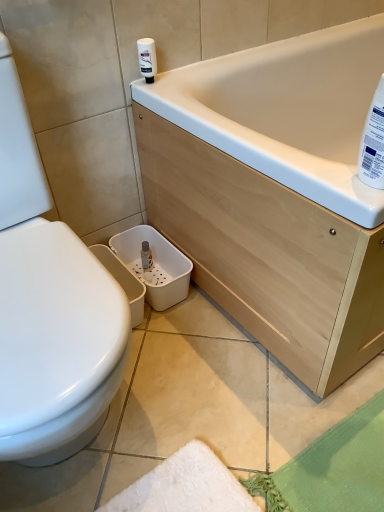
Question: In which direction should I rotate to look at white plastic bottle at upper center, the second cleaning product from the right?

Choices:
 (A) right
 (B) left

Answer: (B)

Question: Is there a large distance between white plastic bottle at upper center, which is the 1th cleaning product in left-to-right order, and white plastic bottle at upper right, which ranks as the 1th cleaning product in front-to-back order?

Choices:
 (A) yes
 (B) no

Answer: (B)

Question: Does white plastic bottle at upper center, the first cleaning product positioned from the top, touch white plastic bottle at upper right, the first cleaning product viewed from the right?

Choices:
 (A) yes
 (B) no

Answer: (B)

Question: Is white plastic bottle at upper center, the first cleaning product positioned from the top, in front of white plastic bottle at upper right, which ranks as the 1th cleaning product in front-to-back order?

Choices:
 (A) no
 (B) yes

Answer: (A)

Question: Can you confirm if white plastic bottle at upper center, the 2th cleaning product ordered from the bottom, is bigger than white plastic bottle at upper right, which ranks as the 1th cleaning product in front-to-back order?

Choices:
 (A) yes
 (B) no

Answer: (B)

Question: From a real-world perspective, is white plastic bottle at upper center, the second cleaning product from the right, beneath white plastic bottle at upper right, which ranks as the 1th cleaning product in front-to-back order?

Choices:
 (A) yes
 (B) no

Answer: (A)

Question: Does white plastic bottle at upper center, which is the 1th cleaning product in left-to-right order, appear on the left side of white plastic bottle at upper right, which ranks as the 1th cleaning product in front-to-back order?

Choices:
 (A) no
 (B) yes

Answer: (B)

Question: From a real-world perspective, is white plastic bottle at upper right, the 1th cleaning product ordered from the bottom, beneath white plastic bottle at upper center, which is the 1th cleaning product in back-to-front order?

Choices:
 (A) yes
 (B) no

Answer: (B)

Question: Does white plastic bottle at upper right, the second cleaning product from the left, have a greater width compared to white plastic bottle at upper center, which is counted as the second cleaning product, starting from the front?

Choices:
 (A) no
 (B) yes

Answer: (B)

Question: Is white plastic bottle at upper right, the second cleaning product from the top, surrounding white plastic bottle at upper center, the second cleaning product from the right?

Choices:
 (A) no
 (B) yes

Answer: (A)

Question: Is white plastic bottle at upper right, the first cleaning product viewed from the right, not within white plastic bottle at upper center, which is counted as the second cleaning product, starting from the front?

Choices:
 (A) yes
 (B) no

Answer: (A)

Question: Can you confirm if white plastic bottle at upper right, which ranks as the 1th cleaning product in front-to-back order, is shorter than white plastic bottle at upper center, the first cleaning product positioned from the top?

Choices:
 (A) no
 (B) yes

Answer: (A)

Question: Does white plastic bottle at upper right, the second cleaning product from the left, touch white plastic bottle at upper center, which is counted as the second cleaning product, starting from the front?

Choices:
 (A) yes
 (B) no

Answer: (B)

Question: Considering the positions of white plastic bottle at upper right, the second cleaning product from the top, and white plastic bottle at upper center, the 2th cleaning product ordered from the bottom, in the image, is white plastic bottle at upper right, the second cleaning product from the top, wider or thinner than white plastic bottle at upper center, the 2th cleaning product ordered from the bottom,?

Choices:
 (A) thin
 (B) wide

Answer: (B)